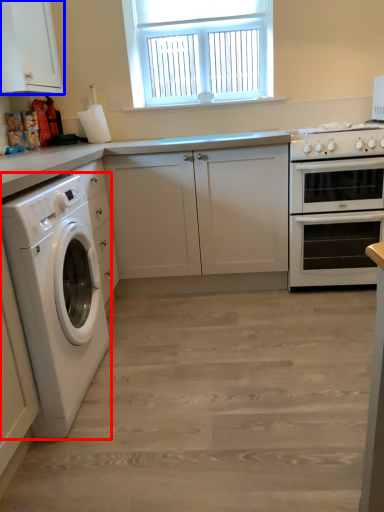
Question: Which object appears closest to the camera in this image, washing machine (highlighted by a red box) or cabinetry (highlighted by a blue box)?

Choices:
 (A) washing machine
 (B) cabinetry

Answer: (A)